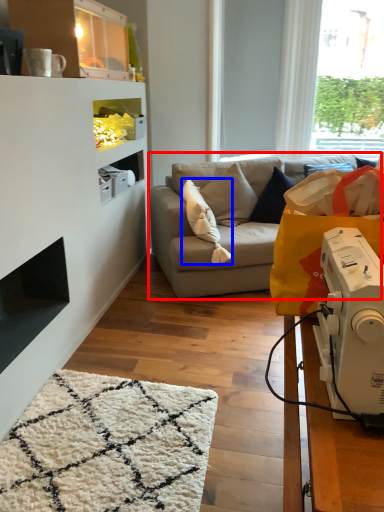
Question: Among these objects, which one is farthest to the camera, studio couch (highlighted by a red box) or pillow (highlighted by a blue box)?

Choices:
 (A) studio couch
 (B) pillow

Answer: (A)